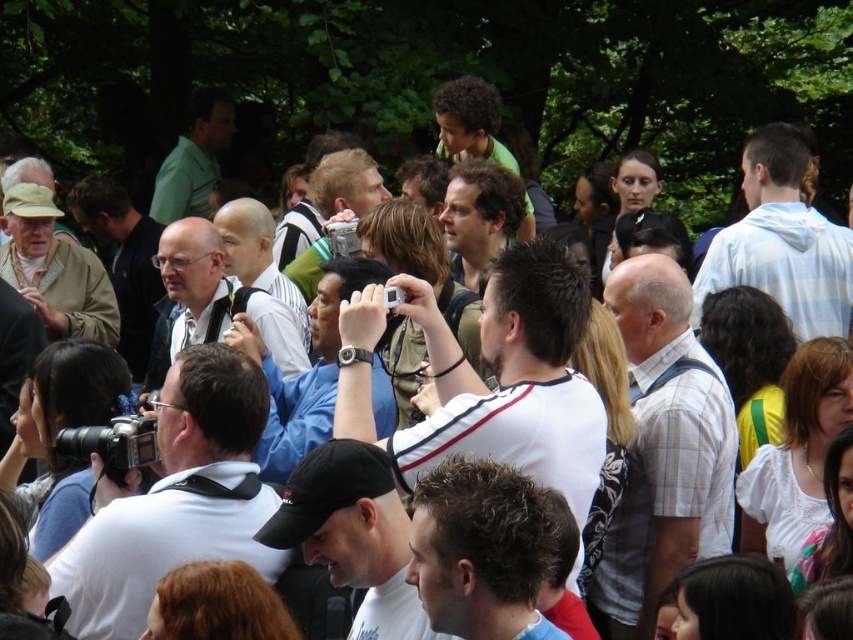
You are a photographer at the event and want to take a clear photo of both the matte black glasses at center and the dark brown leather jacket at center. Which object should you focus on first if you want to ensure both are in focus without adjusting the camera settings?

The matte black glasses at center is not as tall as the dark brown leather jacket at center, so you should focus on the dark brown leather jacket at center first to ensure both are in focus.

You are standing at the origin point of the image. A person wearing a white checkered shirt is at the center. Can you tell me the exact coordinates of the white checkered shirt at center?

The white checkered shirt at center is located at coordinates point (663, 449).